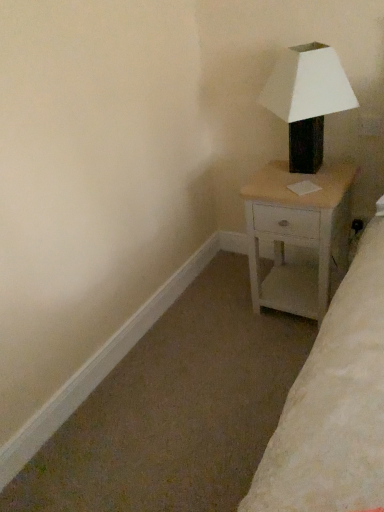
Locate an element on the screen. matte black lamp at upper right is located at coordinates (307, 99).

Consider the image. Measure the distance between matte black lamp at upper right and camera.

1.52 meters.

The image size is (384, 512). What do you see at coordinates (307, 99) in the screenshot?
I see `matte black lamp at upper right` at bounding box center [307, 99].

What do you see at coordinates (297, 234) in the screenshot? This screenshot has width=384, height=512. I see `white wood nightstand at right` at bounding box center [297, 234].

Where is `white wood nightstand at right`? This screenshot has width=384, height=512. white wood nightstand at right is located at coordinates (297, 234).

Where is `matte black lamp at upper right`? This screenshot has height=512, width=384. matte black lamp at upper right is located at coordinates (307, 99).

Which is more to the right, white wood nightstand at right or matte black lamp at upper right?

Positioned to the right is white wood nightstand at right.

Is the position of white wood nightstand at right less distant than that of matte black lamp at upper right?

No, it is behind matte black lamp at upper right.

Considering the positions of points (292, 207) and (313, 80), is point (292, 207) closer to camera compared to point (313, 80)?

No, it is behind (313, 80).

From the image's perspective, is white wood nightstand at right beneath matte black lamp at upper right?

Indeed, from the image's perspective, white wood nightstand at right is shown beneath matte black lamp at upper right.

From a real-world perspective, which object stands above the other?

In real-world perspective, matte black lamp at upper right is above.

In terms of width, does white wood nightstand at right look wider or thinner when compared to matte black lamp at upper right?

white wood nightstand at right is wider than matte black lamp at upper right.

Considering the sizes of objects white wood nightstand at right and matte black lamp at upper right in the image provided, who is shorter, white wood nightstand at right or matte black lamp at upper right?

matte black lamp at upper right.

Does white wood nightstand at right have a smaller size compared to matte black lamp at upper right?

No.

Would you say white wood nightstand at right is inside or outside matte black lamp at upper right?

white wood nightstand at right is located beyond the bounds of matte black lamp at upper right.

Is white wood nightstand at right positioned far away from matte black lamp at upper right?

Actually, white wood nightstand at right and matte black lamp at upper right are a little close together.

Does white wood nightstand at right turn towards matte black lamp at upper right?

No.

Identify the location of lamp above the white wood nightstand at right (from a real-world perspective). (307, 99).

Is matte black lamp at upper right to the right of white wood nightstand at right from the viewer's perspective?

No, matte black lamp at upper right is not to the right of white wood nightstand at right.

Between matte black lamp at upper right and white wood nightstand at right, which one is positioned behind?

white wood nightstand at right is further away from the camera.

Is point (299, 157) closer or farther from the camera than point (318, 202)?

Point (299, 157) appears to be farther away from the viewer than point (318, 202).

From the image's perspective, which one is positioned lower, matte black lamp at upper right or white wood nightstand at right?

From the image's view, white wood nightstand at right is below.

From a real-world perspective, who is located higher, matte black lamp at upper right or white wood nightstand at right?

matte black lamp at upper right, from a real-world perspective.

Does matte black lamp at upper right have a greater width compared to white wood nightstand at right?

No, matte black lamp at upper right is not wider than white wood nightstand at right.

Considering the sizes of objects matte black lamp at upper right and white wood nightstand at right in the image provided, who is taller, matte black lamp at upper right or white wood nightstand at right?

white wood nightstand at right is taller.

In terms of size, does matte black lamp at upper right appear bigger or smaller than white wood nightstand at right?

In the image, matte black lamp at upper right appears to be smaller than white wood nightstand at right.

In the scene shown: Is white wood nightstand at right surrounded by matte black lamp at upper right?

Actually, white wood nightstand at right is outside matte black lamp at upper right.

Is matte black lamp at upper right with white wood nightstand at right?

They are not placed beside each other.

Is matte black lamp at upper right looking in the opposite direction of white wood nightstand at right?

That's not correct — matte black lamp at upper right is not looking away from white wood nightstand at right.

Identify the location of lamp above the white wood nightstand at right (from the image's perspective). (307, 99).

Identify the location of nightstand on the right of matte black lamp at upper right. (297, 234).

Find the location of a particular element. This screenshot has height=512, width=384. lamp above the white wood nightstand at right (from a real-world perspective) is located at coordinates (307, 99).